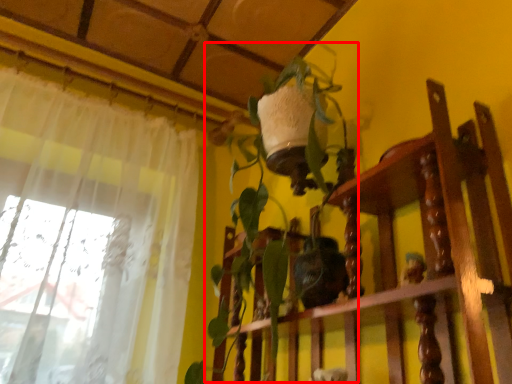
Question: From the image's perspective, what is the correct spatial relationship of vegetation (annotated by the red box) in relation to furniture?

Choices:
 (A) below
 (B) above

Answer: (B)